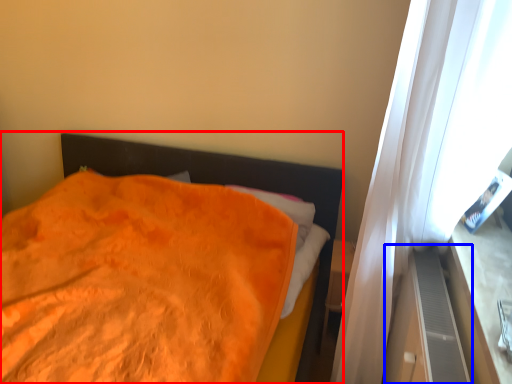
Question: Which of the following is the farthest to the observer, bed (highlighted by a red box) or dresser (highlighted by a blue box)?

Choices:
 (A) bed
 (B) dresser

Answer: (B)